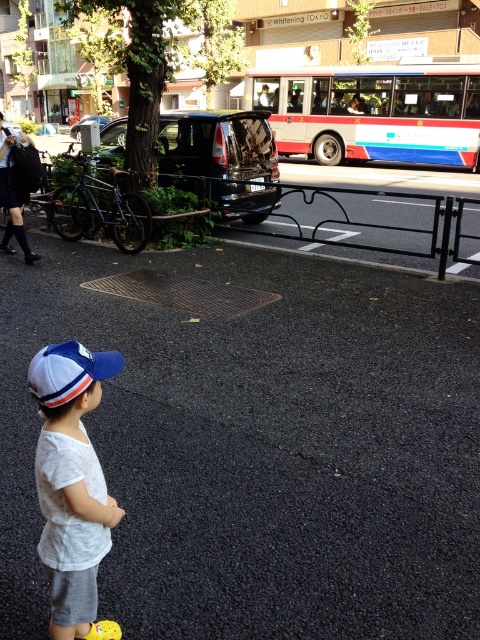
You are a delivery drone flying over an urban area and need to land on the white and blue painted bus at center. According to the coordinates given, where should you aim to land?

The white and blue painted bus at center is located at coordinates point (x=372, y=113), so you should aim for that point to land.